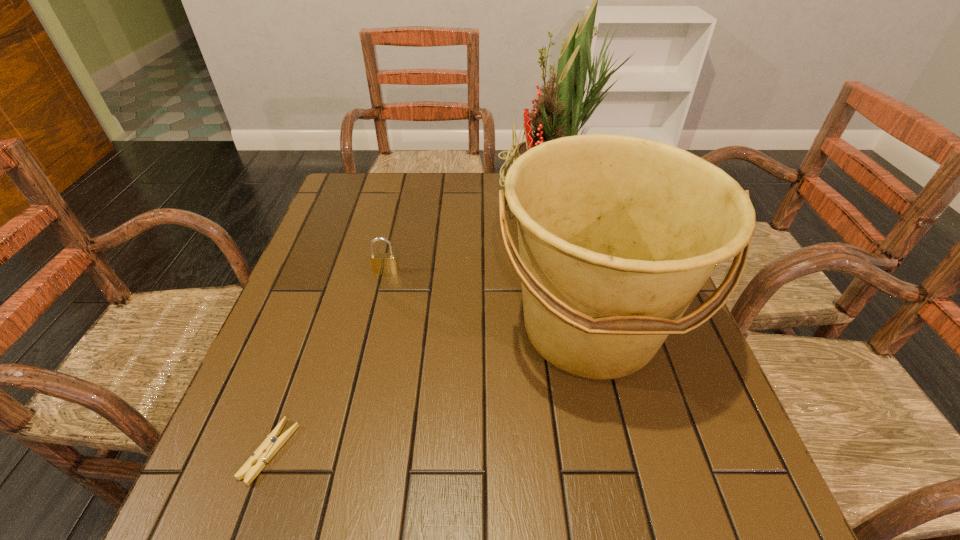
Where is `free space between the third object from right to left and the tallest object`? The height and width of the screenshot is (540, 960). free space between the third object from right to left and the tallest object is located at coordinates (469, 235).

Locate an element on the screen. vacant area that lies between the shortest object and the bucket is located at coordinates (430, 390).

I want to click on free space between the third shortest object and the clothespin, so click(x=430, y=390).

Image resolution: width=960 pixels, height=540 pixels. I want to click on object that stands as the third closest to the padlock, so click(254, 465).

Identify which object is the second nearest to the second shortest object. Please provide its 2D coordinates. Your answer should be formatted as a tuple, i.e. [(x, y)], where the tuple contains the x and y coordinates of a point satisfying the conditions above.

[(559, 113)]

Identify the location of vacant space that satisfies the following two spatial constraints: 1. in front of the farthest object with the fan visible; 2. on the front-facing side of the second shortest object. (568, 272).

Where is `free space that satisfies the following two spatial constraints: 1. in front of the flower arrangement with the fan visible; 2. on the front-facing side of the second shortest object`? free space that satisfies the following two spatial constraints: 1. in front of the flower arrangement with the fan visible; 2. on the front-facing side of the second shortest object is located at coordinates (568, 272).

Identify the location of vacant region that satisfies the following two spatial constraints: 1. in front of the flower arrangement with the fan visible; 2. on the front-facing side of the third object from right to left. (568, 272).

Where is `vacant space that satisfies the following two spatial constraints: 1. in front of the flower arrangement with the fan visible; 2. on the front-facing side of the padlock`? The height and width of the screenshot is (540, 960). vacant space that satisfies the following two spatial constraints: 1. in front of the flower arrangement with the fan visible; 2. on the front-facing side of the padlock is located at coordinates (568, 272).